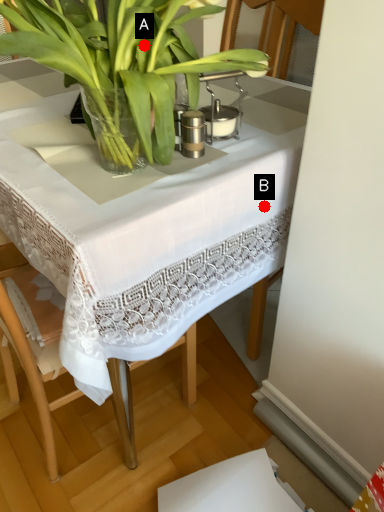
Question: Two points are circled on the image, labeled by A and B beside each circle. Which point is closer to the camera?

Choices:
 (A) A is closer
 (B) B is closer

Answer: (A)